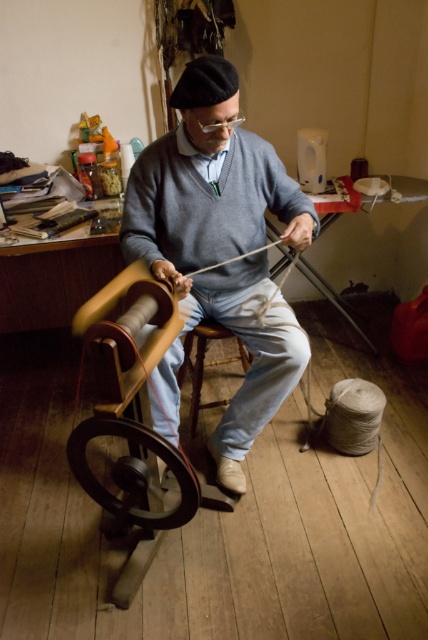
From the picture: Who is higher up, gray wool sweater at center or wooden wheel at lower left?

gray wool sweater at center

Does point (269, 340) lie behind point (178, 508)?

That is True.

This screenshot has height=640, width=428. What do you see at coordinates (220, 243) in the screenshot?
I see `gray wool sweater at center` at bounding box center [220, 243].

At what (x,y) coordinates should I click in order to perform the action: click on gray wool sweater at center. Please return your answer as a coordinate pair (x, y). Image resolution: width=428 pixels, height=640 pixels. Looking at the image, I should click on (220, 243).